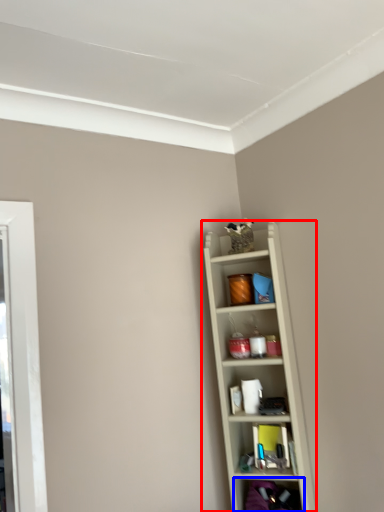
Question: Which point is further to the camera, shelf (highlighted by a red box) or shelf (highlighted by a blue box)?

Choices:
 (A) shelf
 (B) shelf

Answer: (A)